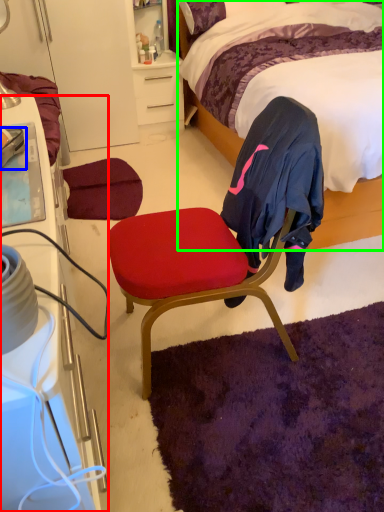
Question: Estimate the real-world distances between objects in this image. Which object is closer to cabinetry (highlighted by a red box), sneakers (highlighted by a blue box) or bed (highlighted by a green box)?

Choices:
 (A) sneakers
 (B) bed

Answer: (A)